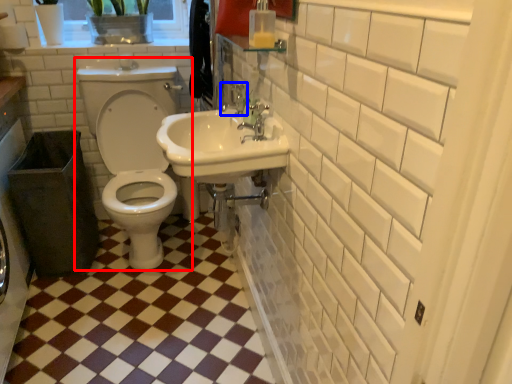
Question: Which point is further to the camera, toilet (highlighted by a red box) or plumbing fixture (highlighted by a blue box)?

Choices:
 (A) toilet
 (B) plumbing fixture

Answer: (A)